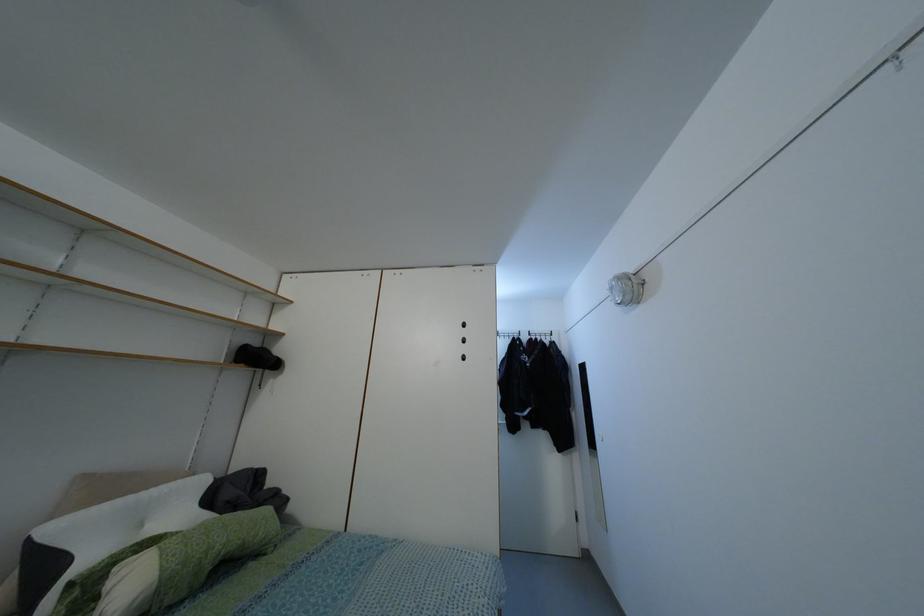
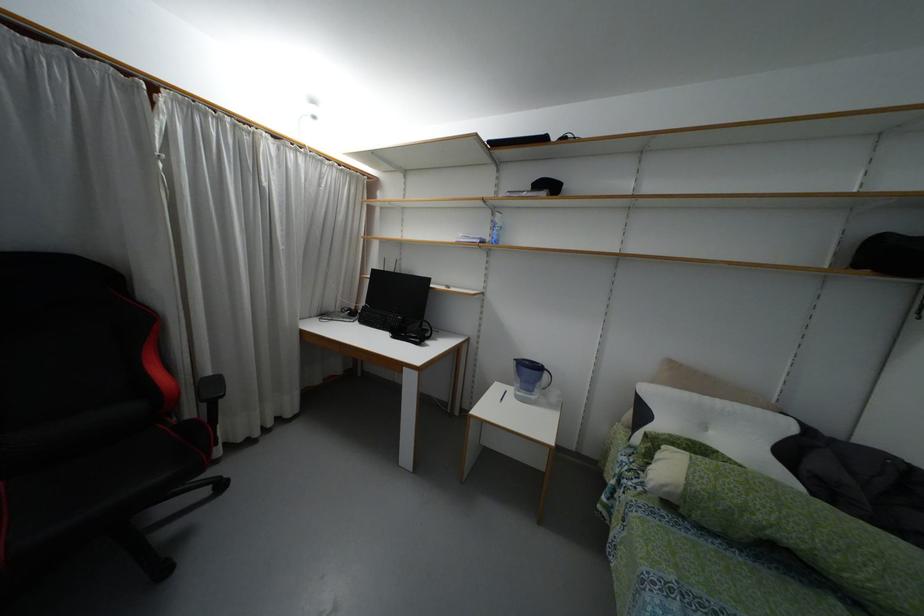
The point at [129,498] is marked in the first image. Where is the corresponding point in the second image?

(695, 395)